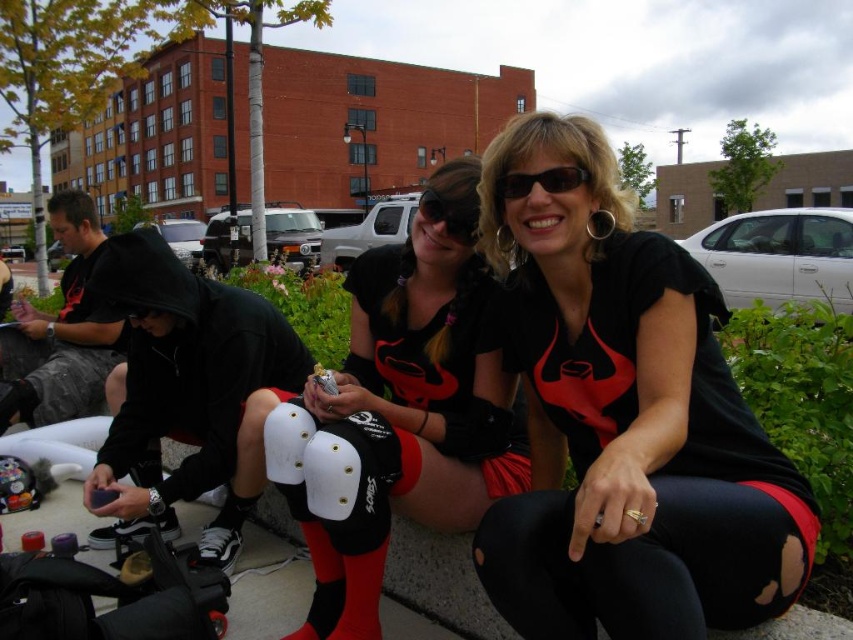
Question: Is black matte leggings at center positioned at the back of black plastic sunglasses at upper center?

Choices:
 (A) yes
 (B) no

Answer: (B)

Question: Among these objects, which one is farthest from the camera?

Choices:
 (A) white matte knee pad at center
 (B) black plastic sunglasses at upper center

Answer: (A)

Question: Is the position of matte black knee pads at center more distant than that of black plastic sunglasses at upper center?

Choices:
 (A) no
 (B) yes

Answer: (B)

Question: Among these points, which one is nearest to the camera?

Choices:
 (A) (554, 166)
 (B) (277, 458)
 (C) (379, 424)

Answer: (A)

Question: Does matte black knee pads at center have a lesser width compared to white matte knee pad at center?

Choices:
 (A) no
 (B) yes

Answer: (A)

Question: Estimate the real-world distances between objects in this image. Which object is farther from the black plastic sunglasses at upper center?

Choices:
 (A) matte black knee pads at center
 (B) black matte leggings at center

Answer: (A)